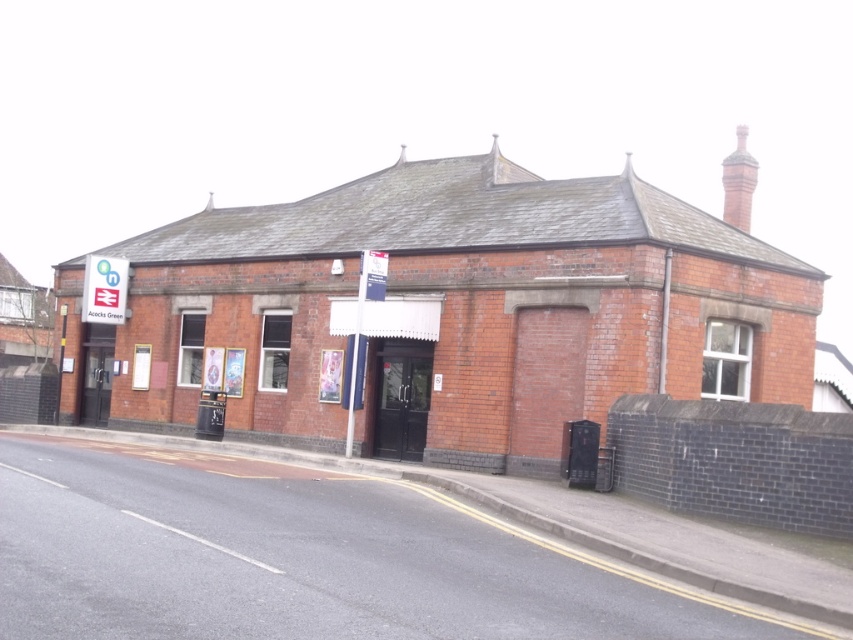
Question: Is white plastic sign at center to the right of white plastic sign at upper left from the viewer's perspective?

Choices:
 (A) yes
 (B) no

Answer: (A)

Question: Does white plastic sign at center appear on the left side of white plastic sign at upper left?

Choices:
 (A) yes
 (B) no

Answer: (B)

Question: Does white plastic sign at center have a larger size compared to white plastic sign at upper left?

Choices:
 (A) no
 (B) yes

Answer: (A)